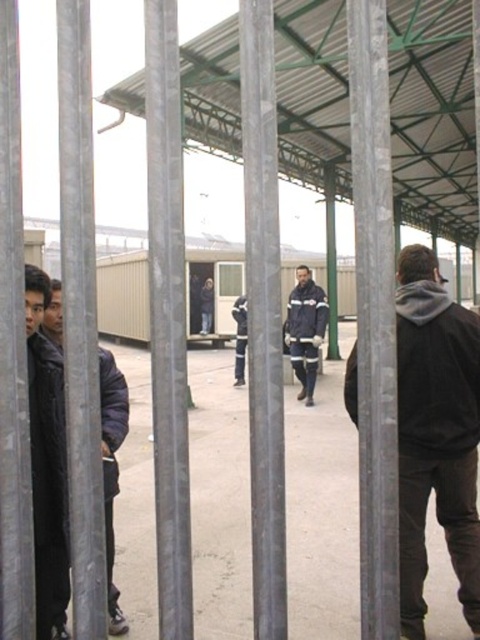
You are a delivery person trying to pass through the fence with a cart that is 5 feet wide. The fence has bars spaced evenly. Can you fit through the gap between the dark gray hoodie at right and dark blue jacket at left?

The dark gray hoodie at right and dark blue jacket at left are 4.86 feet apart from each other, so the gap is narrower than the cart which is 5 feet wide. The cart cannot fit through the gap between the dark gray hoodie at right and dark blue jacket at left.

You are a security guard observing the scene through the metal bars. You notice two people wearing dark blue jackets. Which one is closer to the metal bars, the dark blue jacket at left or the dark blue fabric jacket at center?

The dark blue jacket at left is positioned under the dark blue fabric jacket at center, meaning it is closer to the metal bars.

You are standing at the fence and want to throw a ball to a friend who is at the dark blue fabric jacket at center. The ball can travel 5 meters. Can you reach your friend from the dark gray hoodie at right?

The dark gray hoodie at right is 6.60 meters away from the dark blue fabric jacket at center. Since the ball can only travel 5 meters, you cannot reach your friend at the dark blue fabric jacket at center from the dark gray hoodie at right.